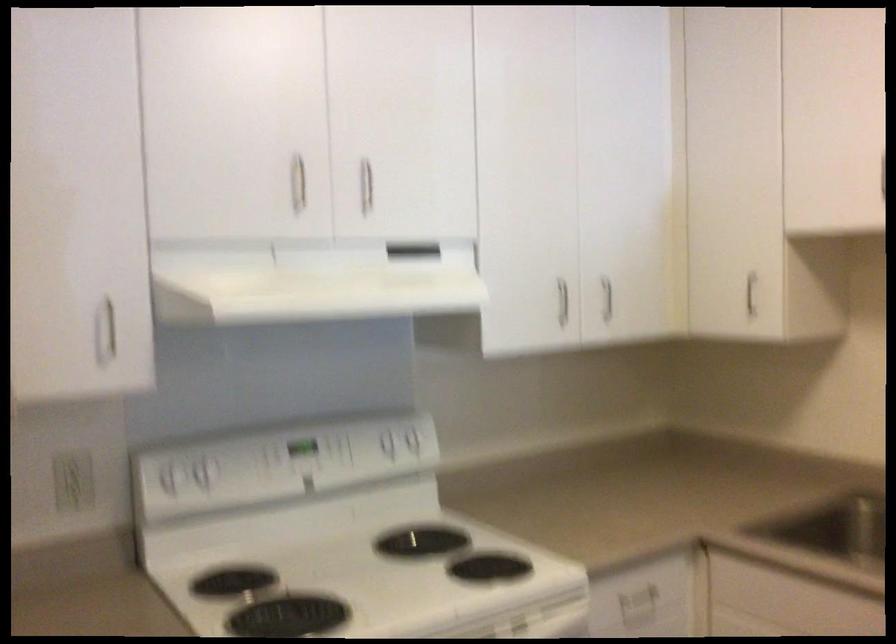
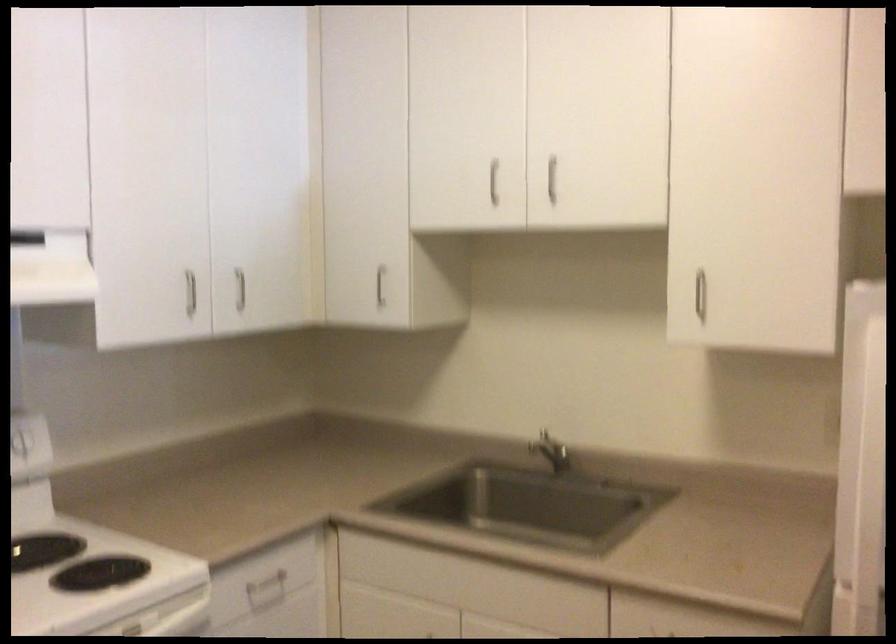
Question: What movement of the cameraman would produce the second image?

Choices:
 (A) Left
 (B) Right
 (C) Forward
 (D) Backward

Answer: (B)